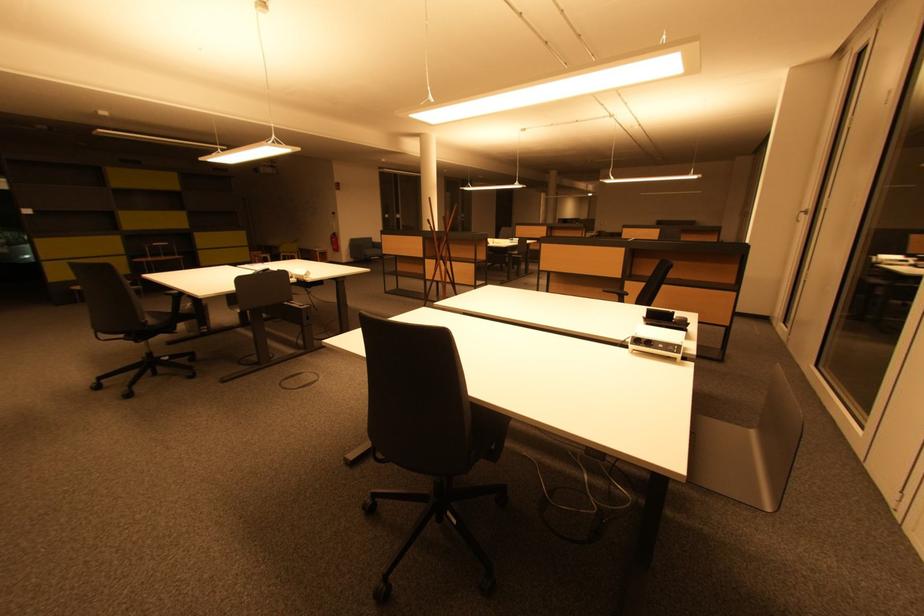
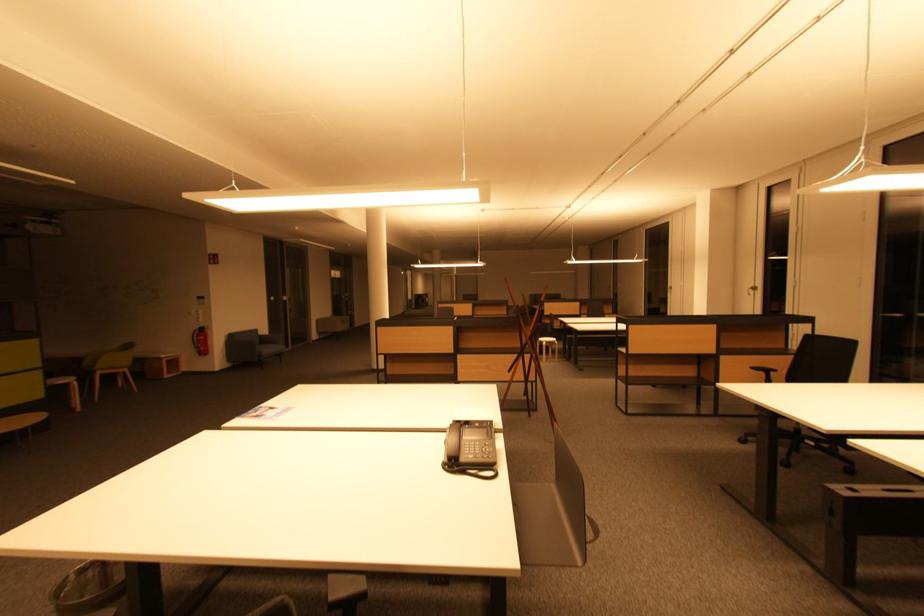
The point at (341, 251) is marked in the first image. Where is the corresponding point in the second image?

(207, 353)